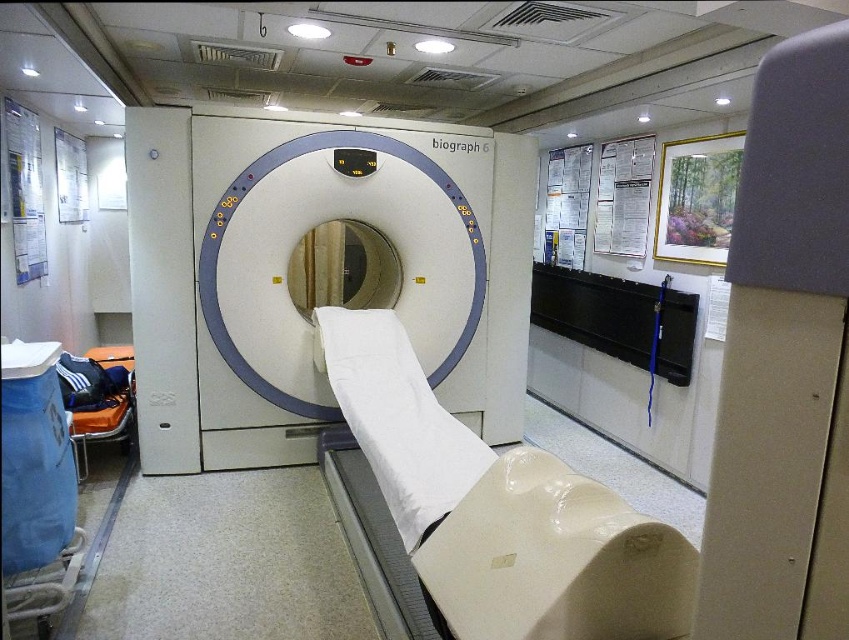
You are standing at the point marked as point (450,260) in a medical imaging room with a Biograph 6 PET scanner. You need to move to the camera located 3.88 meters away. Can you estimate how far you need to walk to reach the camera from your current position?

The point marked as point (450,260) and the camera are 3.88 meters apart, so you need to walk approximately 3.88 meters to reach the camera from your current position.

You are a technician preparing to position a patient for a scan. The patient needs to be centered on the white matte bed at center so that their head is aligned with the opening of the white plastic biograph 6 at center. Based on the current setup, will the bed need to be moved forward or backward to achieve this alignment?

The white plastic biograph 6 at center is positioned over the white matte bed at center. To align the patient head with the scanner opening, the bed should be moved forward so that the patient head reaches the scanner opening.

You are a technician preparing to move a medical cart into the imaging room. The cart is 2 meters wide. You see the white plastic biograph 6 at center and the white matte bed at center. Can the cart fit through the space between these two objects?

The white plastic biograph 6 at center might be wider than the white matte bed at center, so the cart may not have enough space to pass between them. Check the exact width difference before attempting to move the cart.